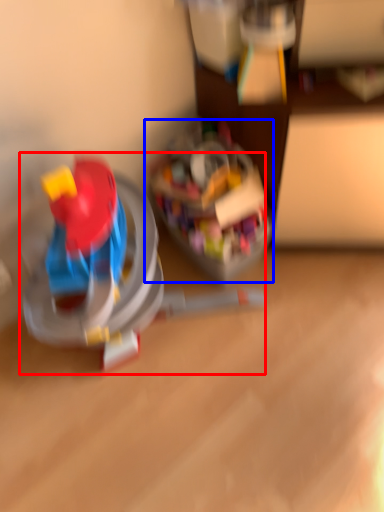
Question: Which object appears closest to the camera in this image, toy (highlighted by a red box) or toy (highlighted by a blue box)?

Choices:
 (A) toy
 (B) toy

Answer: (A)